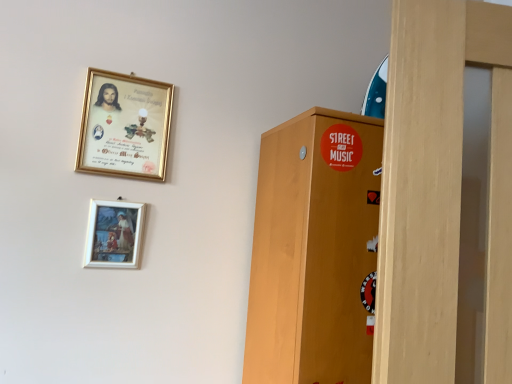
What is the approximate height of gold-framed picture at upper left, the 2th picture frame in the bottom-to-top sequence?

The height of gold-framed picture at upper left, the 2th picture frame in the bottom-to-top sequence, is 11.33 inches.

The height and width of the screenshot is (384, 512). What do you see at coordinates (124, 126) in the screenshot?
I see `gold-framed picture at upper left, the 2th picture frame in the bottom-to-top sequence` at bounding box center [124, 126].

You are a GUI agent. You are given a task and a screenshot of the screen. Output one action in this format:
    pyautogui.click(x=<x>, y=<y>)
    Task: Click on the gold-framed picture at upper left, the 2th picture frame in the bottom-to-top sequence
    
    Given the screenshot: What is the action you would take?
    pyautogui.click(x=124, y=126)

Measure the distance between point (104, 238) and camera.

The depth of point (104, 238) is 1.08 meters.

Describe the element at coordinates (114, 234) in the screenshot. This screenshot has height=384, width=512. I see `matte wooden picture frame at lower center, placed as the second picture frame when sorted from top to bottom` at that location.

Locate an element on the screen. matte wooden picture frame at lower center, placed as the second picture frame when sorted from top to bottom is located at coordinates (114, 234).

Find the location of `gold-framed picture at upper left, the 2th picture frame in the bottom-to-top sequence`. gold-framed picture at upper left, the 2th picture frame in the bottom-to-top sequence is located at coordinates tap(124, 126).

Does matte wooden picture frame at lower center, which ranks as the first picture frame in bottom-to-top order, appear on the left side of gold-framed picture at upper left, the 2th picture frame in the bottom-to-top sequence?

Yes.

Considering the relative positions of matte wooden picture frame at lower center, which ranks as the first picture frame in bottom-to-top order, and gold-framed picture at upper left, the 2th picture frame in the bottom-to-top sequence, in the image provided, is matte wooden picture frame at lower center, which ranks as the first picture frame in bottom-to-top order, in front of gold-framed picture at upper left, the 2th picture frame in the bottom-to-top sequence,?

Yes, it is in front of gold-framed picture at upper left, the 2th picture frame in the bottom-to-top sequence.

Which point is more forward, (140, 222) or (93, 111)?

The point (93, 111) is more forward.

From the image's perspective, is matte wooden picture frame at lower center, placed as the second picture frame when sorted from top to bottom, positioned above or below gold-framed picture at upper left, marked as the first picture frame in a top-to-bottom arrangement?

From the image's perspective, matte wooden picture frame at lower center, placed as the second picture frame when sorted from top to bottom, appears below gold-framed picture at upper left, marked as the first picture frame in a top-to-bottom arrangement.

From a real-world perspective, which is physically above, matte wooden picture frame at lower center, placed as the second picture frame when sorted from top to bottom, or gold-framed picture at upper left, marked as the first picture frame in a top-to-bottom arrangement?

gold-framed picture at upper left, marked as the first picture frame in a top-to-bottom arrangement.

Is matte wooden picture frame at lower center, which ranks as the first picture frame in bottom-to-top order, wider or thinner than gold-framed picture at upper left, the 2th picture frame in the bottom-to-top sequence?

In the image, matte wooden picture frame at lower center, which ranks as the first picture frame in bottom-to-top order, appears to be more narrow than gold-framed picture at upper left, the 2th picture frame in the bottom-to-top sequence.

Is matte wooden picture frame at lower center, which ranks as the first picture frame in bottom-to-top order, shorter than gold-framed picture at upper left, marked as the first picture frame in a top-to-bottom arrangement?

Yes.

Is matte wooden picture frame at lower center, which ranks as the first picture frame in bottom-to-top order, bigger than gold-framed picture at upper left, the 2th picture frame in the bottom-to-top sequence?

Actually, matte wooden picture frame at lower center, which ranks as the first picture frame in bottom-to-top order, might be smaller than gold-framed picture at upper left, the 2th picture frame in the bottom-to-top sequence.

Is matte wooden picture frame at lower center, which ranks as the first picture frame in bottom-to-top order, surrounding gold-framed picture at upper left, the 2th picture frame in the bottom-to-top sequence?

No, gold-framed picture at upper left, the 2th picture frame in the bottom-to-top sequence, is not inside matte wooden picture frame at lower center, which ranks as the first picture frame in bottom-to-top order.

Is there a large distance between matte wooden picture frame at lower center, which ranks as the first picture frame in bottom-to-top order, and gold-framed picture at upper left, marked as the first picture frame in a top-to-bottom arrangement?

Actually, matte wooden picture frame at lower center, which ranks as the first picture frame in bottom-to-top order, and gold-framed picture at upper left, marked as the first picture frame in a top-to-bottom arrangement, are a little close together.

Could you tell me if matte wooden picture frame at lower center, which ranks as the first picture frame in bottom-to-top order, is turned towards gold-framed picture at upper left, marked as the first picture frame in a top-to-bottom arrangement?

No, matte wooden picture frame at lower center, which ranks as the first picture frame in bottom-to-top order, is not facing towards gold-framed picture at upper left, marked as the first picture frame in a top-to-bottom arrangement.

I want to click on picture frame on the left of gold-framed picture at upper left, marked as the first picture frame in a top-to-bottom arrangement, so coord(114,234).

Which is more to the left, gold-framed picture at upper left, the 2th picture frame in the bottom-to-top sequence, or matte wooden picture frame at lower center, which ranks as the first picture frame in bottom-to-top order?

matte wooden picture frame at lower center, which ranks as the first picture frame in bottom-to-top order.

Which object is further away from the camera, gold-framed picture at upper left, marked as the first picture frame in a top-to-bottom arrangement, or matte wooden picture frame at lower center, which ranks as the first picture frame in bottom-to-top order?

gold-framed picture at upper left, marked as the first picture frame in a top-to-bottom arrangement, is behind.

Which point is more distant from viewer, (117, 113) or (102, 207)?

Positioned behind is point (117, 113).

From the image's perspective, which object appears higher, gold-framed picture at upper left, the 2th picture frame in the bottom-to-top sequence, or matte wooden picture frame at lower center, which ranks as the first picture frame in bottom-to-top order?

gold-framed picture at upper left, the 2th picture frame in the bottom-to-top sequence, from the image's perspective.

From a real-world perspective, is gold-framed picture at upper left, marked as the first picture frame in a top-to-bottom arrangement, below matte wooden picture frame at lower center, which ranks as the first picture frame in bottom-to-top order?

Incorrect, from a real-world perspective, gold-framed picture at upper left, marked as the first picture frame in a top-to-bottom arrangement, is higher than matte wooden picture frame at lower center, which ranks as the first picture frame in bottom-to-top order.

Which of these two, gold-framed picture at upper left, the 2th picture frame in the bottom-to-top sequence, or matte wooden picture frame at lower center, which ranks as the first picture frame in bottom-to-top order, is thinner?

Thinner between the two is matte wooden picture frame at lower center, which ranks as the first picture frame in bottom-to-top order.

Who is taller, gold-framed picture at upper left, the 2th picture frame in the bottom-to-top sequence, or matte wooden picture frame at lower center, placed as the second picture frame when sorted from top to bottom?

With more height is gold-framed picture at upper left, the 2th picture frame in the bottom-to-top sequence.

Consider the image. Looking at the image, does gold-framed picture at upper left, marked as the first picture frame in a top-to-bottom arrangement, seem bigger or smaller compared to matte wooden picture frame at lower center, placed as the second picture frame when sorted from top to bottom?

Considering their sizes, gold-framed picture at upper left, marked as the first picture frame in a top-to-bottom arrangement, takes up more space than matte wooden picture frame at lower center, placed as the second picture frame when sorted from top to bottom.

Would you say gold-framed picture at upper left, the 2th picture frame in the bottom-to-top sequence, is inside or outside matte wooden picture frame at lower center, which ranks as the first picture frame in bottom-to-top order?

gold-framed picture at upper left, the 2th picture frame in the bottom-to-top sequence, cannot be found inside matte wooden picture frame at lower center, which ranks as the first picture frame in bottom-to-top order.

Are gold-framed picture at upper left, the 2th picture frame in the bottom-to-top sequence, and matte wooden picture frame at lower center, placed as the second picture frame when sorted from top to bottom, beside each other?

No, gold-framed picture at upper left, the 2th picture frame in the bottom-to-top sequence, is not beside matte wooden picture frame at lower center, placed as the second picture frame when sorted from top to bottom.

Is gold-framed picture at upper left, the 2th picture frame in the bottom-to-top sequence, oriented towards matte wooden picture frame at lower center, placed as the second picture frame when sorted from top to bottom?

No, gold-framed picture at upper left, the 2th picture frame in the bottom-to-top sequence, does not turn towards matte wooden picture frame at lower center, placed as the second picture frame when sorted from top to bottom.

How distant is gold-framed picture at upper left, marked as the first picture frame in a top-to-bottom arrangement, from matte wooden picture frame at lower center, placed as the second picture frame when sorted from top to bottom?

A distance of 7.66 inches exists between gold-framed picture at upper left, marked as the first picture frame in a top-to-bottom arrangement, and matte wooden picture frame at lower center, placed as the second picture frame when sorted from top to bottom.

The height and width of the screenshot is (384, 512). I want to click on picture frame on the right of matte wooden picture frame at lower center, placed as the second picture frame when sorted from top to bottom, so click(x=124, y=126).

Where is `picture frame that is above the matte wooden picture frame at lower center, which ranks as the first picture frame in bottom-to-top order (from a real-world perspective)`? picture frame that is above the matte wooden picture frame at lower center, which ranks as the first picture frame in bottom-to-top order (from a real-world perspective) is located at coordinates click(x=124, y=126).

Identify the location of picture frame located in front of the gold-framed picture at upper left, marked as the first picture frame in a top-to-bottom arrangement. This screenshot has height=384, width=512. (114, 234).